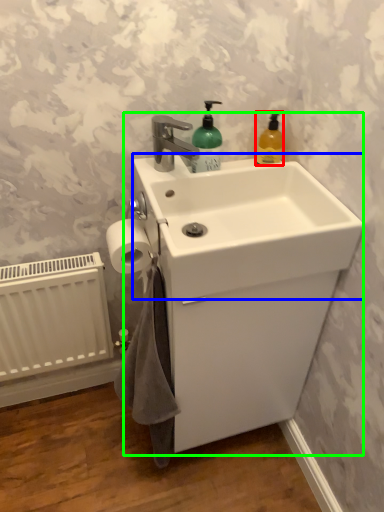
Question: Estimate the real-world distances between objects in this image. Which object is farther from cleaning product (highlighted by a red box), counter top (highlighted by a blue box) or sink (highlighted by a green box)?

Choices:
 (A) counter top
 (B) sink

Answer: (B)